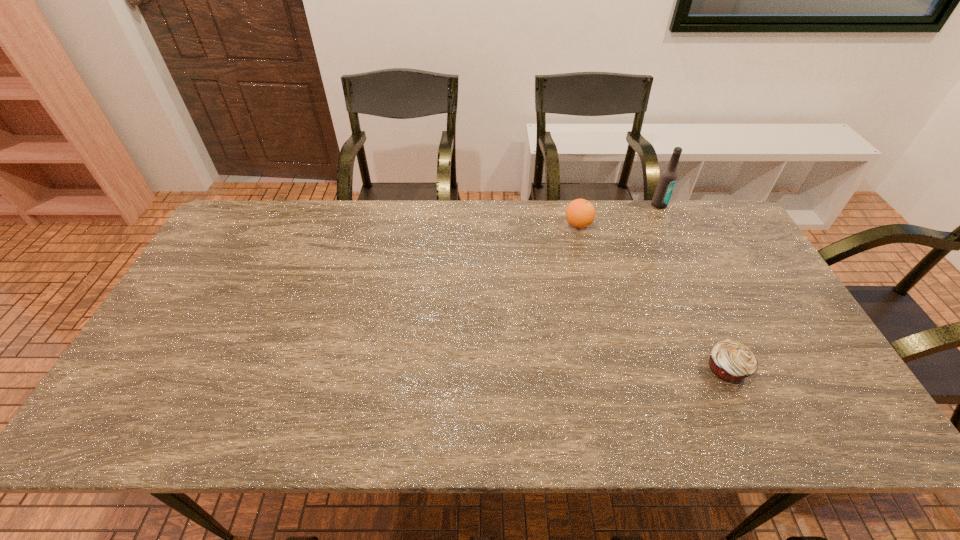
At what (x,y) coordinates should I click in order to perform the action: click on vacant space at the far edge of the desktop. Please return your answer as a coordinate pair (x, y). Image resolution: width=960 pixels, height=540 pixels. Looking at the image, I should click on (442, 225).

Find the location of a particular element. The width and height of the screenshot is (960, 540). free region at the near edge of the desktop is located at coordinates (522, 436).

In the image, there is a desktop. Where is `vacant area at the left edge`? This screenshot has height=540, width=960. vacant area at the left edge is located at coordinates (185, 297).

At what (x,y) coordinates should I click in order to perform the action: click on vacant space at the far left corner. Please return your answer as a coordinate pair (x, y). Looking at the image, I should click on (249, 212).

Where is `free space at the near left corner of the desktop`? This screenshot has width=960, height=540. free space at the near left corner of the desktop is located at coordinates (119, 408).

Identify the location of vacant space at the far right corner of the desktop. This screenshot has height=540, width=960. (690, 214).

Find the location of a particular element. vacant space that's between the nearest object and the farthest object is located at coordinates (693, 287).

Where is `blank region between the muffin and the beer bottle`? blank region between the muffin and the beer bottle is located at coordinates (693, 287).

I want to click on free space that is in between the orange and the tallest object, so click(618, 214).

At what (x,y) coordinates should I click in order to perform the action: click on vacant region between the muffin and the farthest object. Please return your answer as a coordinate pair (x, y). Looking at the image, I should click on (693, 287).